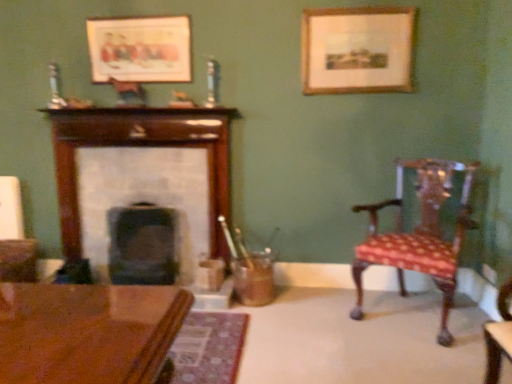
I want to click on vacant area to the left of polished wood chair at right, so click(317, 324).